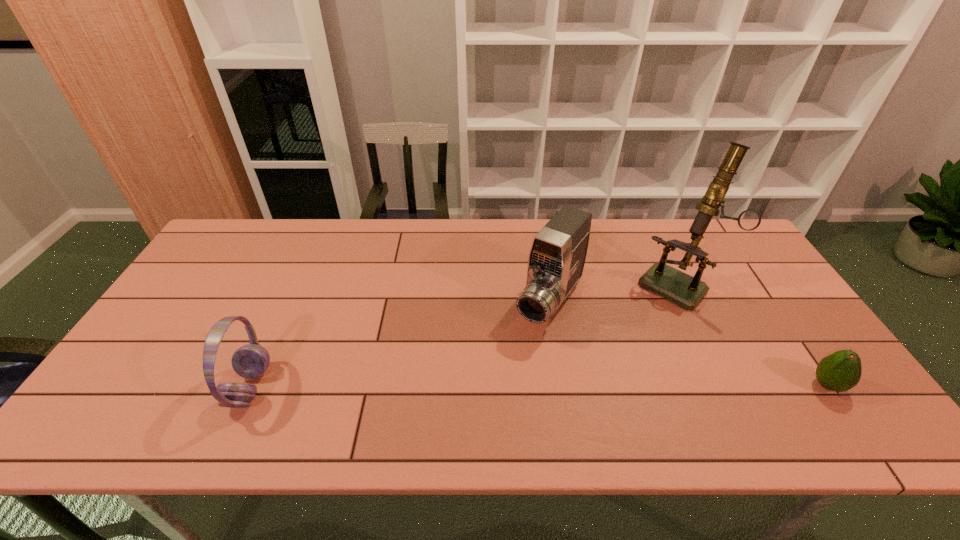
Where is `vacant space located at the eyepiece of the tallest object`? The image size is (960, 540). vacant space located at the eyepiece of the tallest object is located at coordinates (604, 364).

In order to click on vacant space located at the eyepiece of the tallest object in this screenshot , I will do `click(584, 386)`.

Find the location of a particular element. free space located 0.110m at the eyepiece of the tallest object is located at coordinates (639, 325).

The width and height of the screenshot is (960, 540). What are the coordinates of `vacant space located 0.110m at the front of the second object from left to right, highlighting the lens` in the screenshot? It's located at pos(513,366).

The width and height of the screenshot is (960, 540). Identify the location of vacant space situated at the front of the second object from left to right, highlighting the lens. (496, 389).

Where is `vacant region located at the front of the second object from left to right, highlighting the lens`? vacant region located at the front of the second object from left to right, highlighting the lens is located at coordinates (485, 404).

At what (x,y) coordinates should I click in order to perform the action: click on object that is at the far edge. Please return your answer as a coordinate pair (x, y). This screenshot has height=540, width=960. Looking at the image, I should click on (686, 291).

This screenshot has width=960, height=540. I want to click on headset situated at the near edge, so click(250, 361).

The height and width of the screenshot is (540, 960). I want to click on avocado located in the near edge section of the desktop, so click(840, 371).

This screenshot has height=540, width=960. Identify the location of object that is at the right edge. (840, 371).